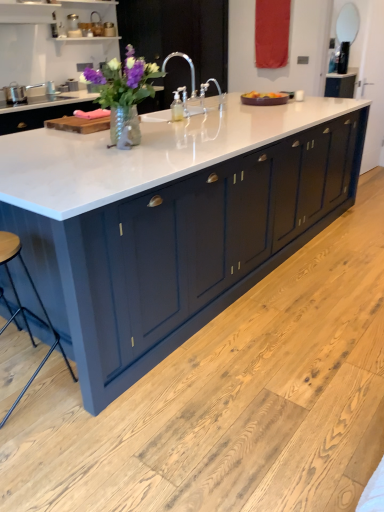
This screenshot has height=512, width=384. In order to click on vacant space underneath white glossy sink at center (from a real-world perspective) in this screenshot , I will do `click(178, 115)`.